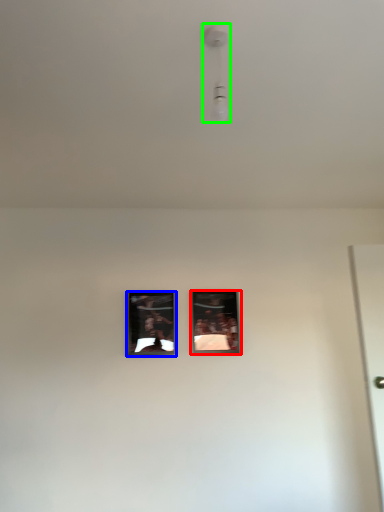
Question: Considering the real-world distances, which object is farthest from picture frame (highlighted by a red box)? picture frame (highlighted by a blue box) or light fixture (highlighted by a green box)?

Choices:
 (A) picture frame
 (B) light fixture

Answer: (B)